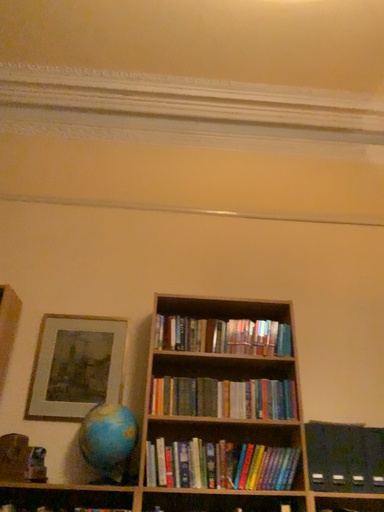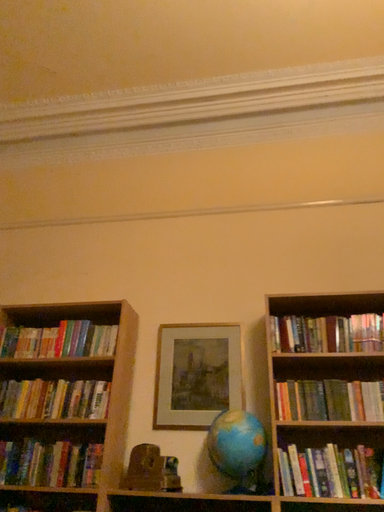
Question: How did the camera likely rotate when shooting the video?

Choices:
 (A) rotated left
 (B) rotated right

Answer: (A)